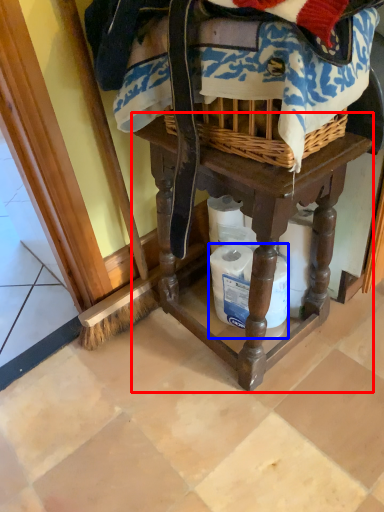
Question: Which object is closer to the camera taking this photo, furniture (highlighted by a red box) or toilet paper (highlighted by a blue box)?

Choices:
 (A) furniture
 (B) toilet paper

Answer: (A)